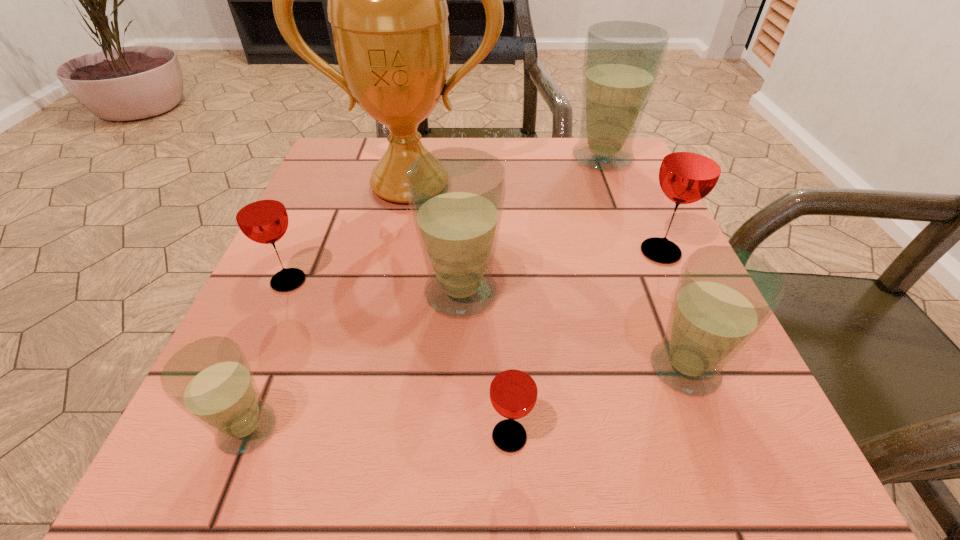
Find the location of `free region that satisfies the following two spatial constraints: 1. on the back side of the second smallest red glass; 2. on the right side of the rightmost red glass`. free region that satisfies the following two spatial constraints: 1. on the back side of the second smallest red glass; 2. on the right side of the rightmost red glass is located at coordinates (301, 252).